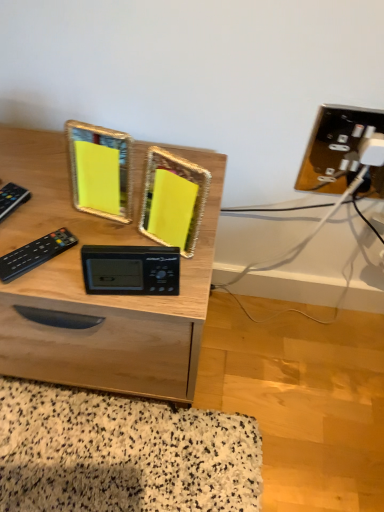
Image resolution: width=384 pixels, height=512 pixels. I want to click on vacant space to the right of black plastic remote at left, the first control viewed from the right, so click(x=129, y=282).